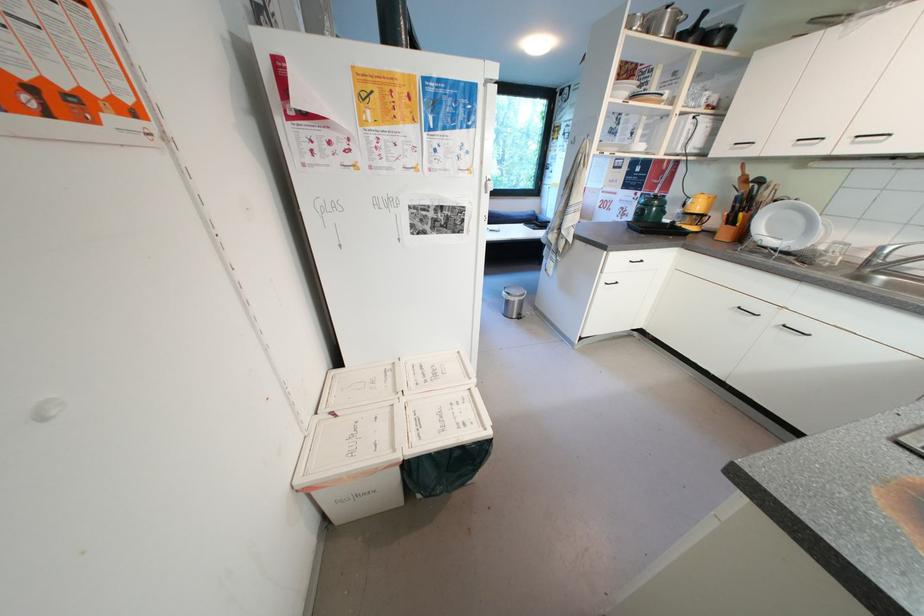
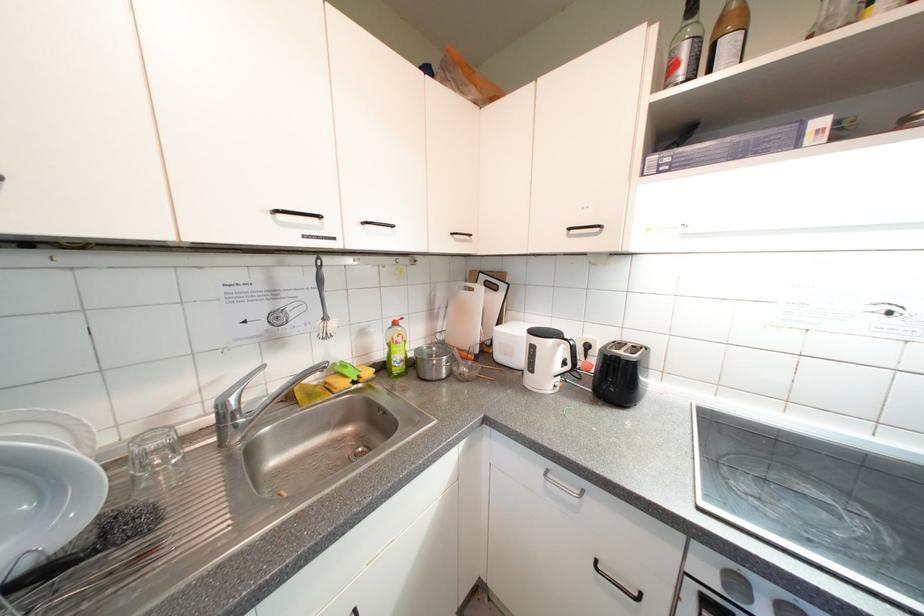
Where in the second image is the point corresponding to (x=845, y=249) from the first image?

(162, 447)